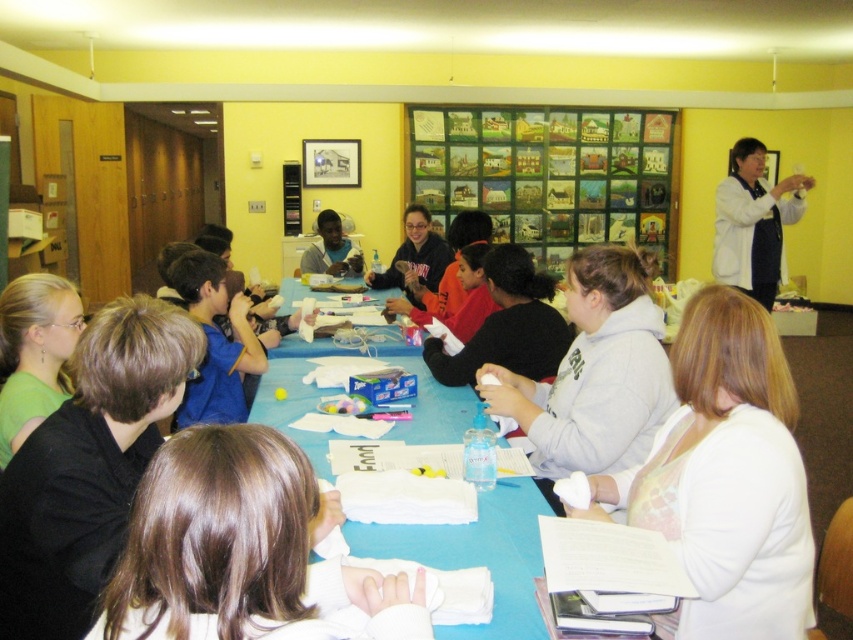
You are a person with a height of 1.6 meters standing at the brown hair at lower center position. You want to reach the wooden framed paintings at upper center located 6.89 meters away. Can you reach it without any assistance?

The wooden framed paintings at upper center is 6.89 meters away from the brown hair at lower center. Since the maximum reaching distance for a person of 1.6 meters is typically around 1.8 to 2 meters, you cannot reach the wooden framed paintings at upper center without assistance.

You are a photographer standing at the back of the room. You want to take a photo of the brown hair at lower center and ensure they are in focus. The camera you are using has a depth of field that can cover 80 centimeters. Will the entire subject be in focus?

The brown hair at lower center are 84.27 centimeters apart. Since the depth of field can only cover 80 centimeters, the entire subject will not be in focus.

You are standing in the classroom and want to reach both the point at coordinates (215, 476) and the point at coordinates (668, 115). Which point will you reach first?

You will reach the point at coordinates (215, 476) first because it is closer to you than the point at coordinates (668, 115).